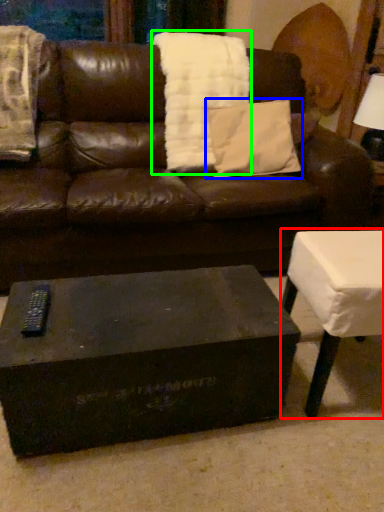
Question: Which object is positioned farthest from table (highlighted by a red box)? Select from pillow (highlighted by a blue box) and blanket (highlighted by a green box).

Choices:
 (A) pillow
 (B) blanket

Answer: (B)